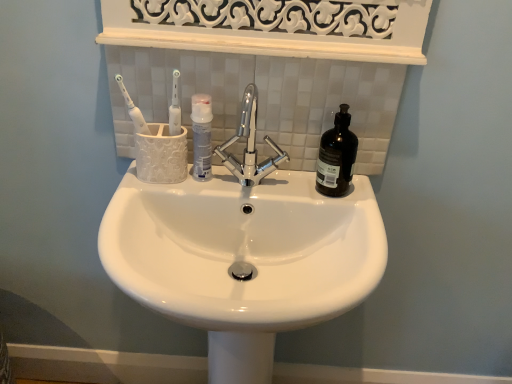
Question: Is black glass bottle at right, arranged as the second mouthwash when viewed from the left, inside the boundaries of white glossy toothbrush at upper left, or outside?

Choices:
 (A) outside
 (B) inside

Answer: (A)

Question: Is point (345, 117) closer or farther from the camera than point (122, 89)?

Choices:
 (A) closer
 (B) farther

Answer: (A)

Question: Which is nearer to the chrome metallic faucet at center?

Choices:
 (A) black glass bottle at right, arranged as the second mouthwash when viewed from the left
 (B) white glossy sink at center
 (C) white matte mouthwash at center, acting as the 2th mouthwash starting from the right
 (D) white glossy toothbrush at upper left

Answer: (C)

Question: Based on their relative distances, which object is farther from the white glossy sink at center?

Choices:
 (A) white matte mouthwash at center, acting as the 2th mouthwash starting from the right
 (B) chrome metallic faucet at center
 (C) black glass bottle at right, arranged as the second mouthwash when viewed from the left
 (D) white glossy toothbrush at upper left

Answer: (D)